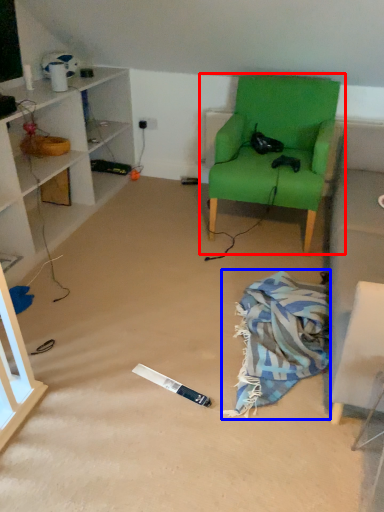
Question: Among these objects, which one is farthest to the camera, chair (highlighted by a red box) or blanket (highlighted by a blue box)?

Choices:
 (A) chair
 (B) blanket

Answer: (A)